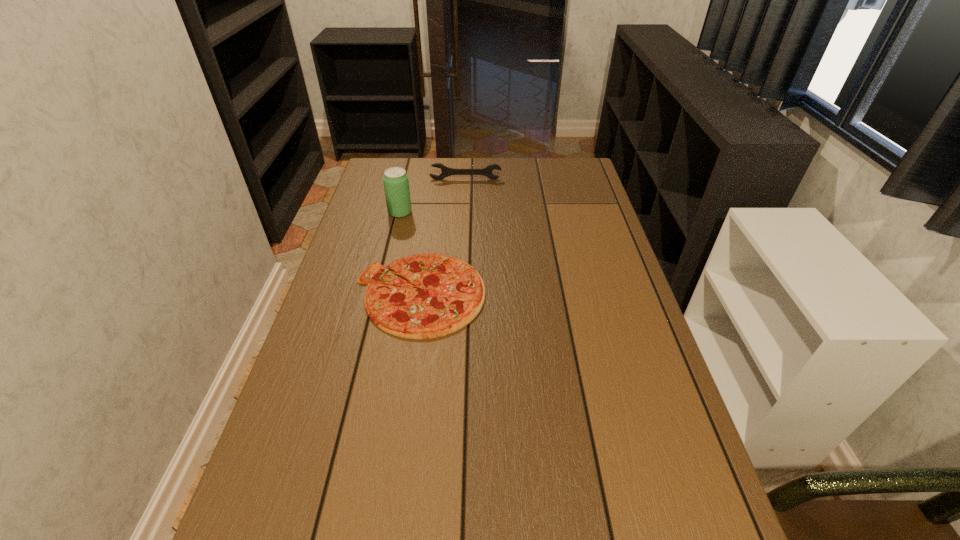
Locate an element on the screen. This screenshot has height=540, width=960. soda that is at the left edge is located at coordinates (396, 185).

Identify the location of pizza located in the left edge section of the desktop. (451, 293).

Locate an element on the screen. vacant region at the far edge of the desktop is located at coordinates (523, 183).

Where is `vacant space at the left edge`? The height and width of the screenshot is (540, 960). vacant space at the left edge is located at coordinates (321, 373).

Identify the location of blank space at the right edge of the desktop. (628, 361).

In the image, there is a desktop. Where is `vacant space at the far right corner`? The image size is (960, 540). vacant space at the far right corner is located at coordinates (578, 157).

Locate an element on the screen. free space between the wrench and the pizza is located at coordinates (443, 237).

What are the coordinates of `vacant space in between the soda and the nearest object` in the screenshot? It's located at (410, 253).

Find the location of `vacant region between the second tallest object and the shortest object`. vacant region between the second tallest object and the shortest object is located at coordinates (443, 237).

This screenshot has width=960, height=540. What are the coordinates of `vacant point located between the wrench and the shortest object` in the screenshot? It's located at (443, 237).